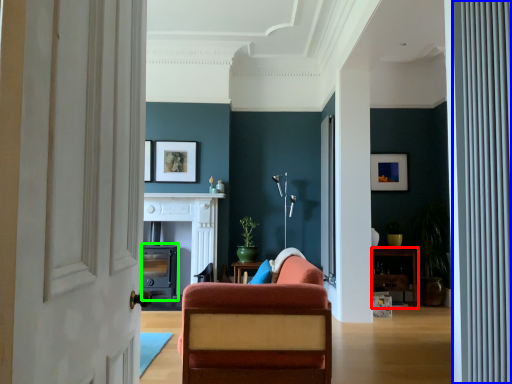
Question: Considering the real-world distances, which object is closest to furniture (highlighted by a red box)? curtain (highlighted by a blue box) or fireplace (highlighted by a green box).

Choices:
 (A) curtain
 (B) fireplace

Answer: (B)